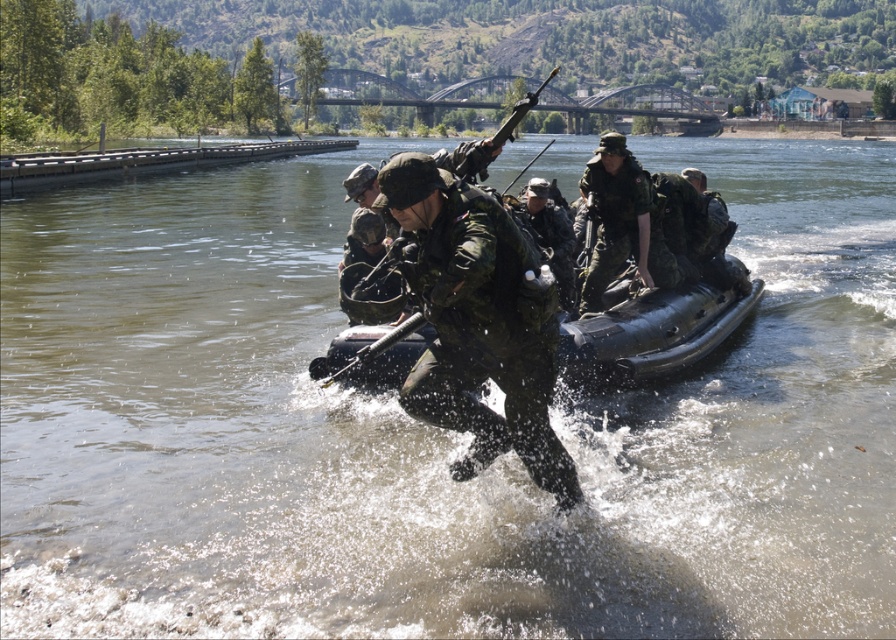
Between black rubber boat at center and matte green uniform at center, which one is positioned higher?

matte green uniform at center is above.

Who is taller, black rubber boat at center or matte green uniform at center?

matte green uniform at center is taller.

Who is more distant from viewer, (x=386, y=337) or (x=608, y=259)?

Result: Positioned behind is point (x=608, y=259).

Image resolution: width=896 pixels, height=640 pixels. I want to click on black rubber boat at center, so click(648, 332).

Can you confirm if camouflage fabric soldier at center is positioned to the left of matte green uniform at center?

Yes, camouflage fabric soldier at center is to the left of matte green uniform at center.

Is camouflage fabric soldier at center smaller than matte green uniform at center?

Yes, camouflage fabric soldier at center is smaller than matte green uniform at center.

You are a GUI agent. You are given a task and a screenshot of the screen. Output one action in this format:
    pyautogui.click(x=<x>, y=<y>)
    Task: Click on the camouflage fabric soldier at center
    The width and height of the screenshot is (896, 640).
    Given the screenshot: What is the action you would take?
    pyautogui.click(x=478, y=323)

Who is more forward, (597, 356) or (550, 221)?

Point (597, 356)

Can you confirm if black rubber boat at center is positioned to the right of green matte uniform at center?

Indeed, black rubber boat at center is positioned on the right side of green matte uniform at center.

Is point (747, 307) more distant than point (570, 225)?

No, (747, 307) is closer to viewer.

Image resolution: width=896 pixels, height=640 pixels. What are the coordinates of `black rubber boat at center` in the screenshot? It's located at (648, 332).